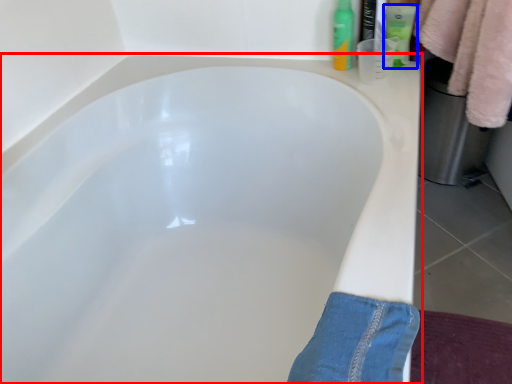
Question: Which of the following is the closest to the observer, bathtub (highlighted by a red box) or toiletry (highlighted by a blue box)?

Choices:
 (A) bathtub
 (B) toiletry

Answer: (A)